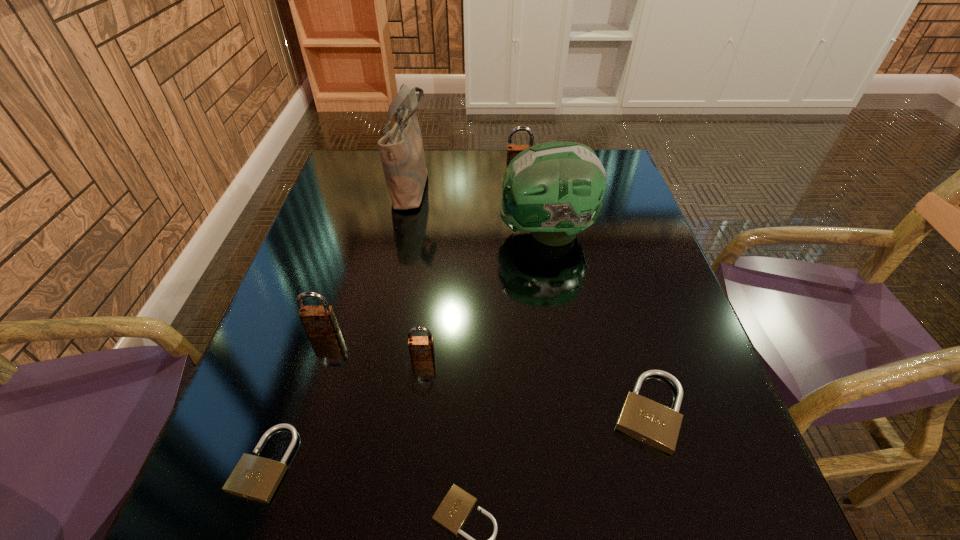
Find the location of a particular element. The image size is (960, 540). the third object from left to right is located at coordinates (402, 154).

Image resolution: width=960 pixels, height=540 pixels. Find the location of `the tallest object`. the tallest object is located at coordinates (402, 154).

This screenshot has width=960, height=540. Find the location of `football helmet`. football helmet is located at coordinates (554, 190).

The image size is (960, 540). Find the location of `the seventh shortest object`. the seventh shortest object is located at coordinates (554, 190).

This screenshot has height=540, width=960. What are the coordinates of `the farthest brown padlock` in the screenshot? It's located at (512, 150).

The height and width of the screenshot is (540, 960). In order to click on the farthest padlock in this screenshot , I will do `click(512, 150)`.

At what (x,y) coordinates should I click in order to perform the action: click on the second nearest brown padlock. Please return your answer as a coordinate pair (x, y). Looking at the image, I should click on tap(318, 321).

At what (x,y) coordinates should I click in order to perform the action: click on the fifth shortest padlock. Please return your answer as a coordinate pair (x, y). Looking at the image, I should click on (318, 321).

This screenshot has width=960, height=540. I want to click on the fourth padlock from right to left, so click(x=421, y=348).

The image size is (960, 540). In order to click on the fifth tallest object in this screenshot , I will do `click(421, 348)`.